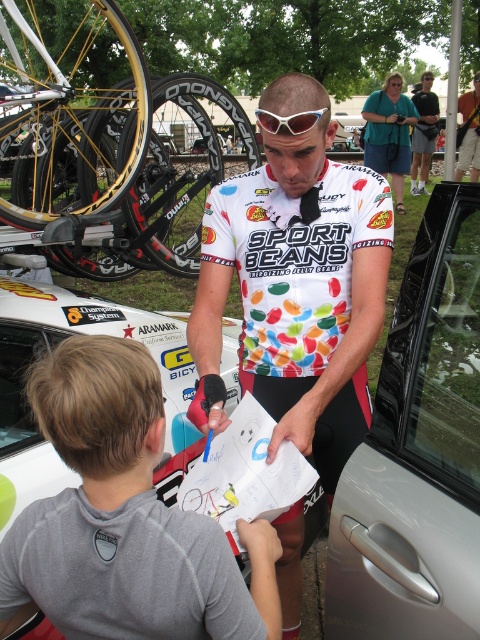
Does point (476, 260) come closer to viewer compared to point (479, 97)?

Yes, it is in front of point (479, 97).

Does silver metallic car door at right come in front of white glossy jersey at center?

That is True.

Describe the element at coordinates (418, 451) in the screenshot. I see `silver metallic car door at right` at that location.

Where is `silver metallic car door at right`? silver metallic car door at right is located at coordinates click(418, 451).

Between blue-green fabric purse at upper center and matte black shirt at upper center, which one has less height?

blue-green fabric purse at upper center

Describe the element at coordinates (388, 132) in the screenshot. I see `blue-green fabric purse at upper center` at that location.

This screenshot has height=640, width=480. Identify the location of blue-green fabric purse at upper center. (388, 132).

Between white jersey at center and white glossy jersey at center, which one is positioned lower?

white jersey at center is below.

Which is above, white jersey at center or white glossy jersey at center?

white glossy jersey at center is higher up.

Is point (212, 212) positioned in front of point (472, 140)?

That is True.

Identify the location of white jersey at center. This screenshot has height=640, width=480. (296, 294).